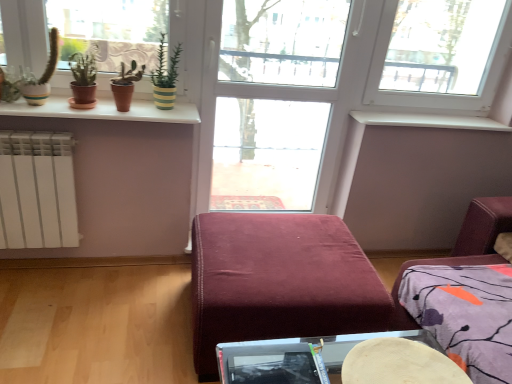
Question: Considering the relative sizes of transparent glass door at center and green striped pot at upper center in the image provided, is transparent glass door at center thinner than green striped pot at upper center?

Choices:
 (A) no
 (B) yes

Answer: (B)

Question: From a real-world perspective, does transparent glass door at center sit lower than green striped pot at upper center?

Choices:
 (A) no
 (B) yes

Answer: (B)

Question: Considering the relative sizes of transparent glass door at center and green striped pot at upper center in the image provided, is transparent glass door at center wider than green striped pot at upper center?

Choices:
 (A) yes
 (B) no

Answer: (B)

Question: Does transparent glass door at center have a greater height compared to green striped pot at upper center?

Choices:
 (A) no
 (B) yes

Answer: (B)

Question: Is transparent glass door at center positioned with its back to green striped pot at upper center?

Choices:
 (A) yes
 (B) no

Answer: (B)

Question: In the image, is white glossy window sill at upper left, positioned as the 1th window sill in left-to-right order, positioned in front of or behind velvet burgundy ottoman at center?

Choices:
 (A) behind
 (B) front

Answer: (A)

Question: From a real-world perspective, is white glossy window sill at upper left, positioned as the 1th window sill in left-to-right order, above or below velvet burgundy ottoman at center?

Choices:
 (A) above
 (B) below

Answer: (A)

Question: From the image's perspective, is white glossy window sill at upper left, acting as the second window sill starting from the right, above or below velvet burgundy ottoman at center?

Choices:
 (A) above
 (B) below

Answer: (A)

Question: Considering the positions of white glossy window sill at upper left, which ranks as the first window sill in front-to-back order, and velvet burgundy ottoman at center in the image, is white glossy window sill at upper left, which ranks as the first window sill in front-to-back order, bigger or smaller than velvet burgundy ottoman at center?

Choices:
 (A) small
 (B) big

Answer: (A)

Question: Considering the relative positions of white glossy window sill at upper left, the second window sill from the back, and white smooth window sill at upper center, which is counted as the first window sill, starting from the back, in the image provided, is white glossy window sill at upper left, the second window sill from the back, to the left or to the right of white smooth window sill at upper center, which is counted as the first window sill, starting from the back,?

Choices:
 (A) left
 (B) right

Answer: (A)

Question: Is white glossy window sill at upper left, which ranks as the first window sill in front-to-back order, bigger or smaller than white smooth window sill at upper center, which is counted as the first window sill, starting from the right?

Choices:
 (A) big
 (B) small

Answer: (A)

Question: Does point (144, 107) appear closer or farther from the camera than point (395, 125)?

Choices:
 (A) closer
 (B) farther

Answer: (A)

Question: Looking at their shapes, would you say white glossy window sill at upper left, positioned as the 1th window sill in left-to-right order, is wider or thinner than white smooth window sill at upper center, the 2th window sill viewed from the left?

Choices:
 (A) wide
 (B) thin

Answer: (A)

Question: Is white glossy window sill at upper left, the second window sill from the back, in front of or behind transparent glass door at center in the image?

Choices:
 (A) front
 (B) behind

Answer: (A)

Question: From a real-world perspective, is white glossy window sill at upper left, positioned as the 1th window sill in left-to-right order, physically located above or below transparent glass door at center?

Choices:
 (A) below
 (B) above

Answer: (B)